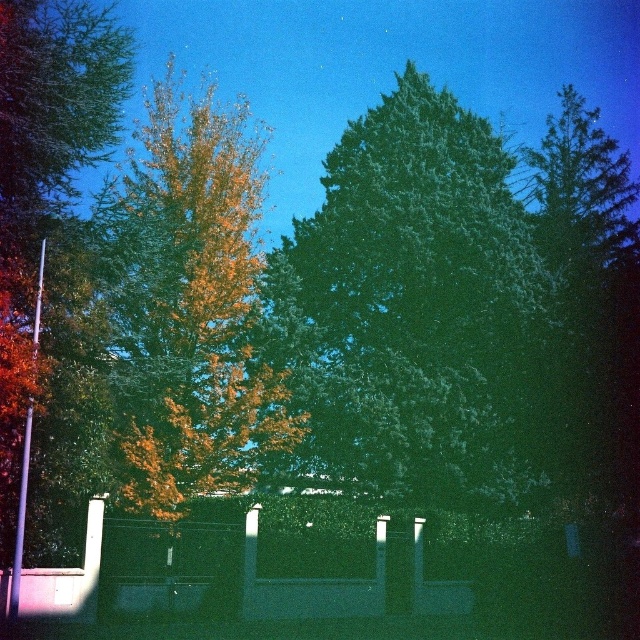
Question: Does green leafy tree at center come in front of golden yellow leaves at center?

Choices:
 (A) yes
 (B) no

Answer: (B)

Question: Which point is farther to the camera?

Choices:
 (A) golden yellow leaves at center
 (B) green leafy tree at center

Answer: (B)

Question: Can you confirm if green leafy tree at center is smaller than golden yellow leaves at center?

Choices:
 (A) no
 (B) yes

Answer: (B)

Question: Is green leafy tree at center smaller than golden yellow leaves at center?

Choices:
 (A) no
 (B) yes

Answer: (B)